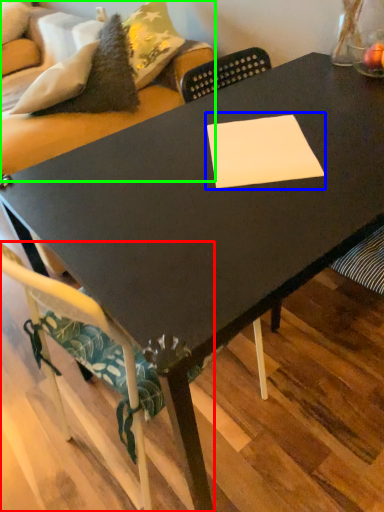
Question: Estimate the real-world distances between objects in this image. Which object is farther from chair (highlighted by a red box), rectangle (highlighted by a blue box) or couch (highlighted by a green box)?

Choices:
 (A) rectangle
 (B) couch

Answer: (B)